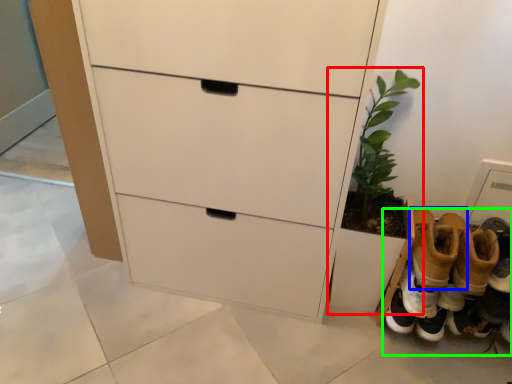
Question: Estimate the real-world distances between objects in this image. Which object is closer to houseplant (highlighted by a red box), footwear (highlighted by a blue box) or footwear (highlighted by a green box)?

Choices:
 (A) footwear
 (B) footwear

Answer: (A)